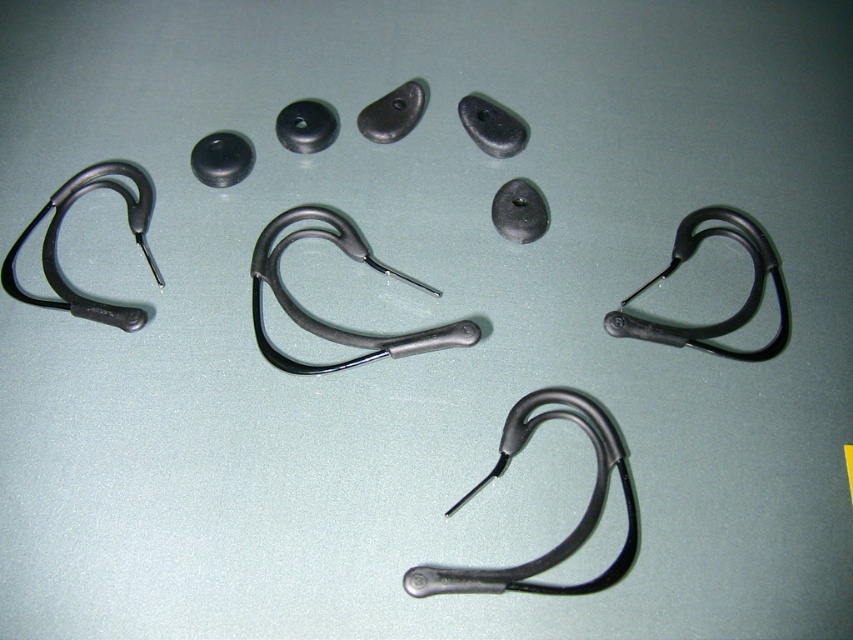
Who is taller, matte black stethoscope at center or matte black earhook at left?

matte black earhook at left

You are a GUI agent. You are given a task and a screenshot of the screen. Output one action in this format:
    pyautogui.click(x=<x>, y=<y>)
    Task: Click on the matte black stethoscope at center
    
    Given the screenshot: What is the action you would take?
    pos(329,323)

Image resolution: width=853 pixels, height=640 pixels. I want to click on matte black stethoscope at center, so click(x=329, y=323).

Is matte black earhook at center closer to camera compared to black rubber earhook at upper right?

Yes, it is in front of black rubber earhook at upper right.

Locate an element on the screen. The image size is (853, 640). matte black earhook at center is located at coordinates (573, 529).

Is point (526, 410) farther from viewer compared to point (772, 256)?

No, (526, 410) is closer to viewer.

Where is `matte black earhook at center`? matte black earhook at center is located at coordinates (573, 529).

Between matte black stethoscope at center and black rubber earhook at upper right, which one has more height?

With more height is matte black stethoscope at center.

Is matte black stethoscope at center wider than black rubber earhook at upper right?

Yes, matte black stethoscope at center is wider than black rubber earhook at upper right.

Is point (457, 321) more distant than point (717, 205)?

No, it is not.

The width and height of the screenshot is (853, 640). I want to click on matte black stethoscope at center, so coord(329,323).